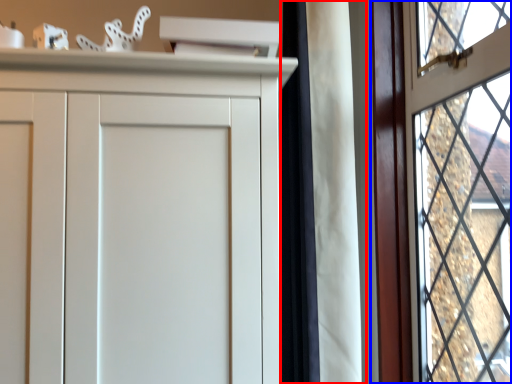
Question: Which of the following is the closest to the observer, curtain (highlighted by a red box) or window (highlighted by a blue box)?

Choices:
 (A) curtain
 (B) window

Answer: (B)